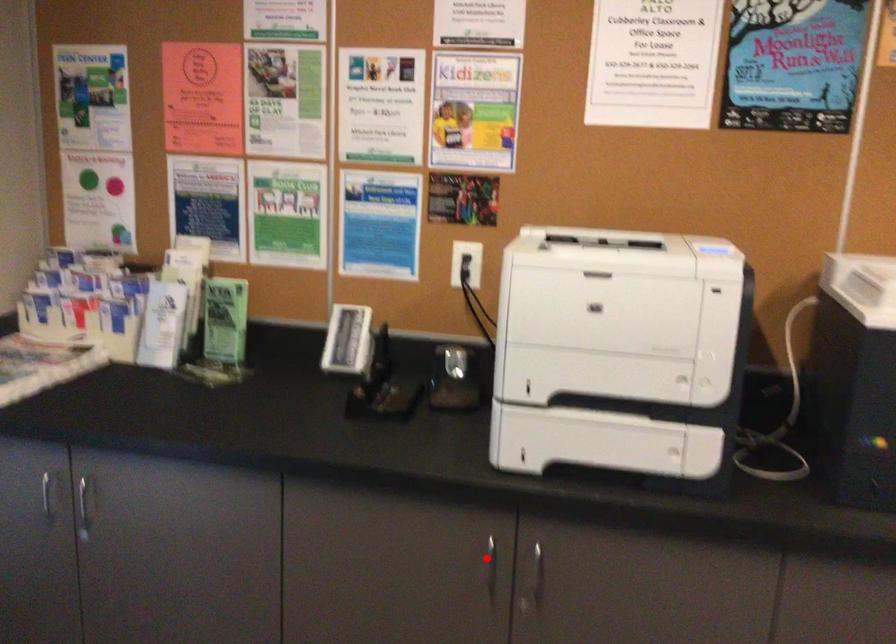
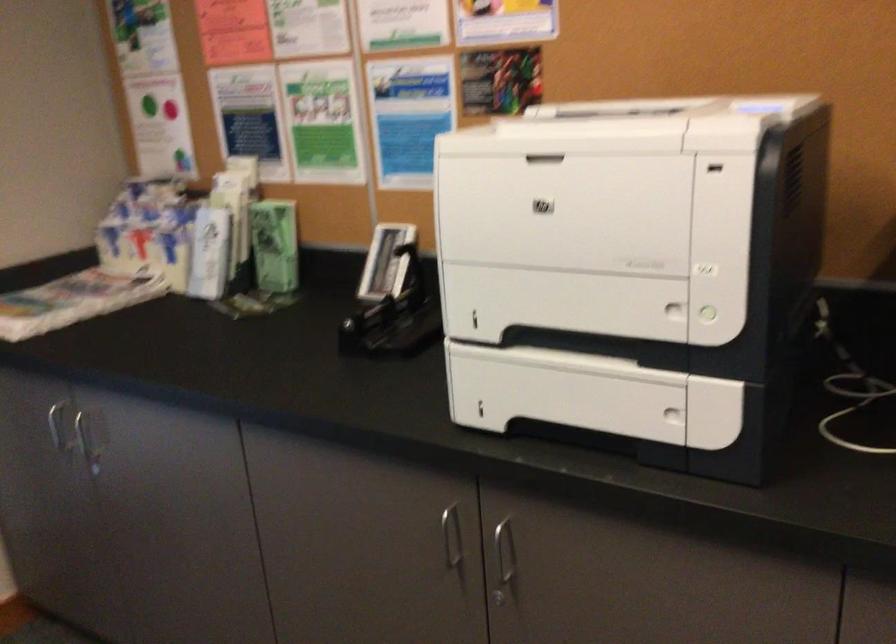
Find the pixel in the second image that matches the highlighted location in the first image.

(452, 538)